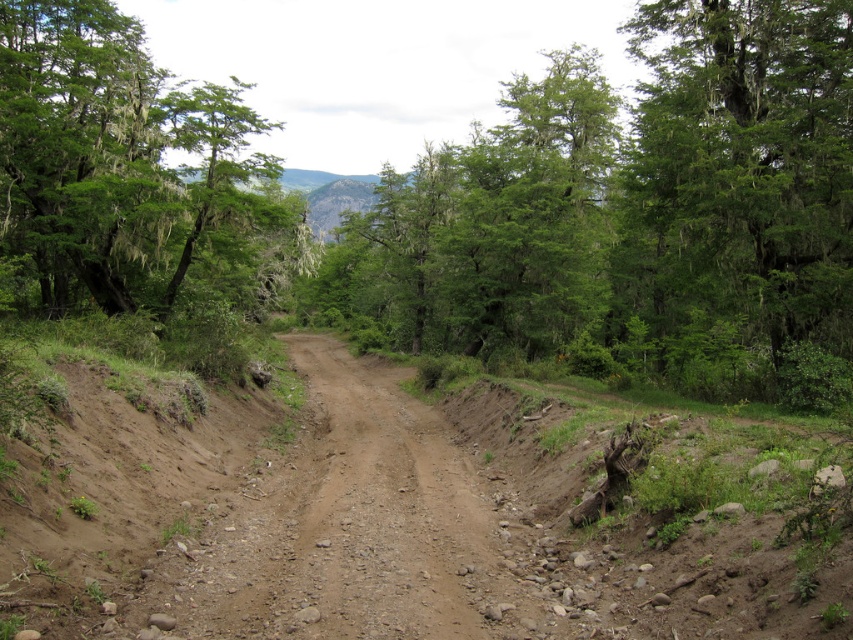
Question: Does green matte tree at upper right lie in front of brown gravelly dirt track at center?

Choices:
 (A) no
 (B) yes

Answer: (A)

Question: Which point appears closest to the camera in this image?

Choices:
 (A) (125, 285)
 (B) (770, 314)
 (C) (670, 257)
 (D) (381, 577)

Answer: (D)

Question: Does green mossy tree at upper left have a larger size compared to brown gravelly dirt track at center?

Choices:
 (A) yes
 (B) no

Answer: (A)

Question: Estimate the real-world distances between objects in this image. Which object is farther from the green matte tree at upper right?

Choices:
 (A) green mossy tree at upper left
 (B) brown gravelly dirt track at center

Answer: (A)

Question: Can you confirm if green matte tree at upper right is positioned above green mossy tree at upper left?

Choices:
 (A) yes
 (B) no

Answer: (B)

Question: Which point is closer to the camera taking this photo?

Choices:
 (A) (735, 252)
 (B) (729, 148)
 (C) (155, 100)

Answer: (B)